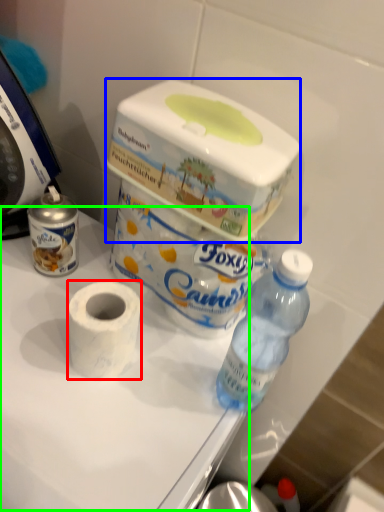
Question: Which is nearer to the toilet paper (highlighted by a red box)? box (highlighted by a blue box) or table (highlighted by a green box).

Choices:
 (A) box
 (B) table

Answer: (B)